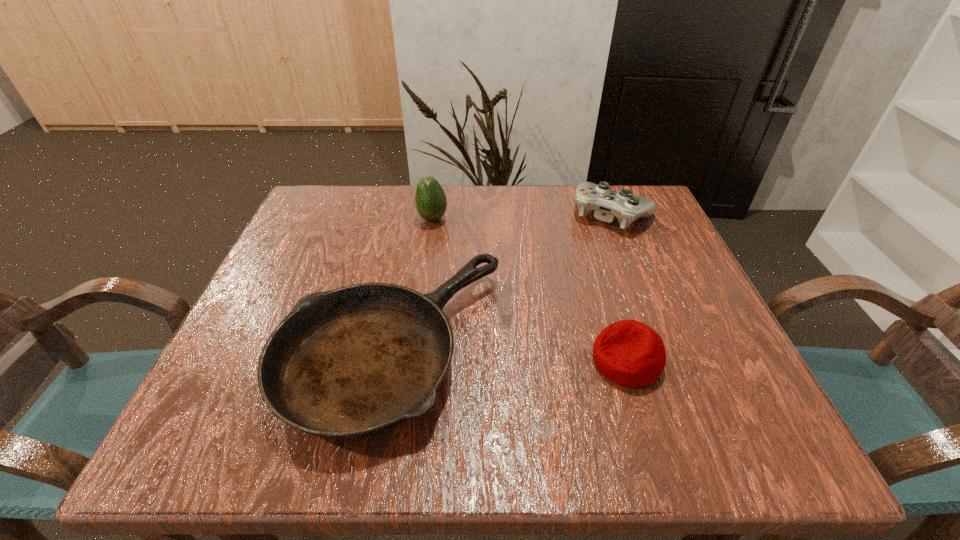
Where is `the tallest object`? the tallest object is located at coordinates (430, 199).

What are the coordinates of `control` in the screenshot? It's located at click(x=608, y=204).

I want to click on the third tallest object, so click(630, 353).

The image size is (960, 540). I want to click on the shortest object, so (353, 362).

I want to click on vacant space situated on the front of the avocado, so click(412, 368).

Locate an element on the screen. Image resolution: width=960 pixels, height=540 pixels. free region located 0.050m on the front of the control is located at coordinates (626, 249).

At what (x,y) coordinates should I click in order to perform the action: click on blank space located on the seat area of the beanbag. Please return your answer as a coordinate pair (x, y). Image resolution: width=960 pixels, height=540 pixels. Looking at the image, I should click on (440, 360).

Locate an element on the screen. The width and height of the screenshot is (960, 540). blank space located on the seat area of the beanbag is located at coordinates (457, 360).

At what (x,y) coordinates should I click in order to perform the action: click on vacant space situated 0.100m on the seat area of the beanbag. Please return your answer as a coordinate pair (x, y). The height and width of the screenshot is (540, 960). Looking at the image, I should click on (534, 360).

You are a GUI agent. You are given a task and a screenshot of the screen. Output one action in this format:
    pyautogui.click(x=<x>, y=<y>)
    Task: Click on the free spot located 0.270m on the right of the frying pan
    
    Given the screenshot: What is the action you would take?
    [x=656, y=347]